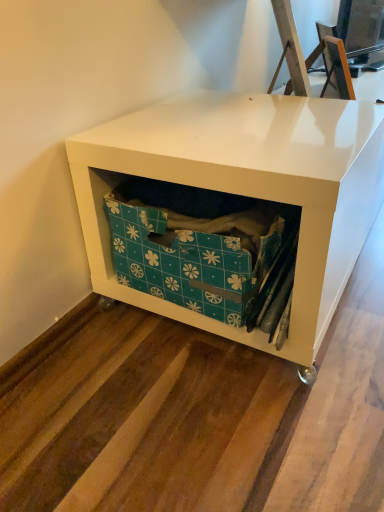
Question: Is white glossy storage unit at center to the left of teal floral-patterned box at center from the viewer's perspective?

Choices:
 (A) yes
 (B) no

Answer: (B)

Question: Does white glossy storage unit at center have a lesser width compared to teal floral-patterned box at center?

Choices:
 (A) no
 (B) yes

Answer: (A)

Question: Would you say white glossy storage unit at center is outside teal floral-patterned box at center?

Choices:
 (A) no
 (B) yes

Answer: (B)

Question: Is white glossy storage unit at center oriented towards teal floral-patterned box at center?

Choices:
 (A) no
 (B) yes

Answer: (B)

Question: Considering the relative sizes of white glossy storage unit at center and teal floral-patterned box at center in the image provided, is white glossy storage unit at center smaller than teal floral-patterned box at center?

Choices:
 (A) yes
 (B) no

Answer: (B)

Question: From the image's perspective, is white glossy storage unit at center on teal floral-patterned box at center?

Choices:
 (A) yes
 (B) no

Answer: (A)

Question: Is teal floral-patterned box at center located outside white glossy storage unit at center?

Choices:
 (A) yes
 (B) no

Answer: (B)

Question: Is teal floral-patterned box at center smaller than white glossy storage unit at center?

Choices:
 (A) yes
 (B) no

Answer: (A)

Question: From the image's perspective, is teal floral-patterned box at center beneath white glossy storage unit at center?

Choices:
 (A) yes
 (B) no

Answer: (A)

Question: Does teal floral-patterned box at center have a greater height compared to white glossy storage unit at center?

Choices:
 (A) yes
 (B) no

Answer: (B)

Question: Does teal floral-patterned box at center have a lesser width compared to white glossy storage unit at center?

Choices:
 (A) yes
 (B) no

Answer: (A)

Question: Is the depth of teal floral-patterned box at center less than that of white glossy storage unit at center?

Choices:
 (A) yes
 (B) no

Answer: (B)

Question: From their relative heights in the image, would you say teal floral-patterned box at center is taller or shorter than white glossy storage unit at center?

Choices:
 (A) tall
 (B) short

Answer: (B)